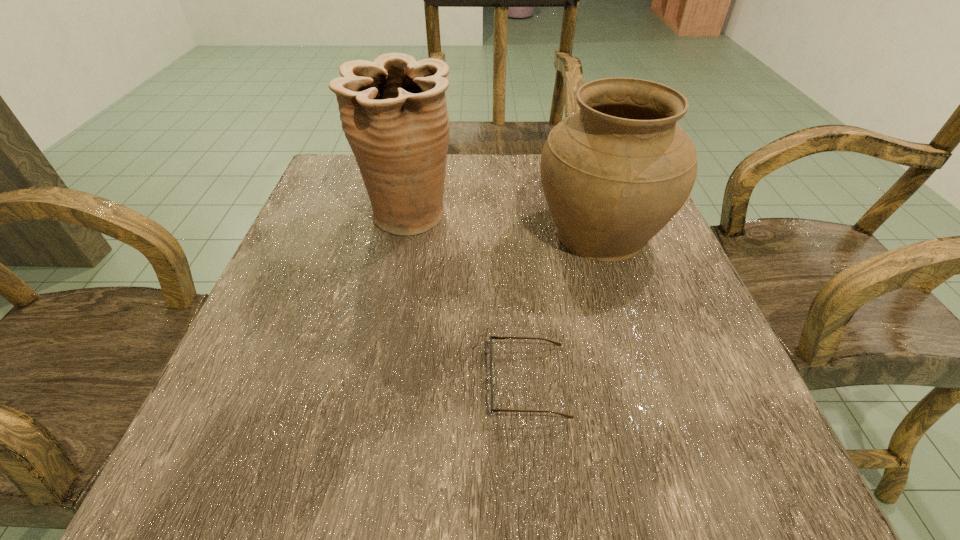
Identify the location of blank space that satisfies the following two spatial constraints: 1. on the front side of the right urn; 2. on the front-facing side of the nearest object. (646, 381).